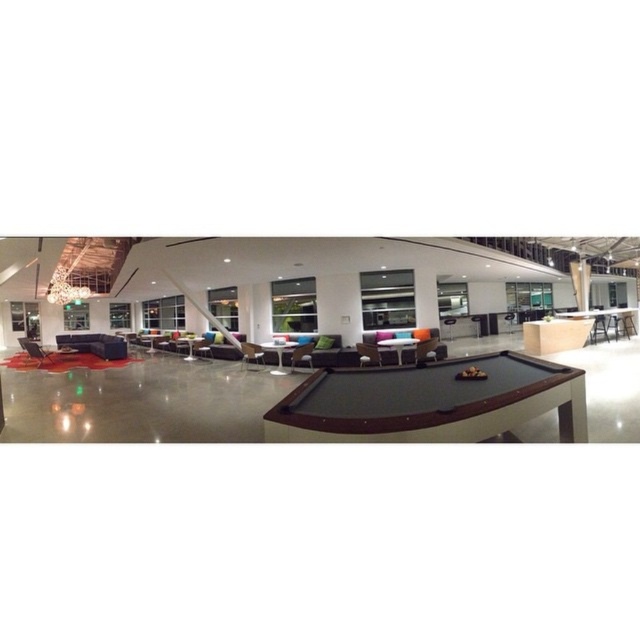
Question: Which is farther from the green fabric armchair at center?

Choices:
 (A) matte black armchair at left
 (B) matte gray armchair at center

Answer: (A)

Question: Among these objects, which one is nearest to the camera?

Choices:
 (A) green fabric armchair at center
 (B) matte black armchair at left
 (C) dark brown wood pool table at center
 (D) matte gray armchair at center

Answer: (C)

Question: Does matte gray armchair at center appear under green fabric armchair at center?

Choices:
 (A) no
 (B) yes

Answer: (B)

Question: Is matte black armchair at left bigger than green fabric armchair at center?

Choices:
 (A) no
 (B) yes

Answer: (B)

Question: Is matte black armchair at left positioned behind matte gray armchair at center?

Choices:
 (A) no
 (B) yes

Answer: (B)

Question: Which of the following is the closest to the observer?

Choices:
 (A) matte gray armchair at center
 (B) green fabric armchair at center
 (C) matte black armchair at left
 (D) dark brown wood pool table at center

Answer: (D)